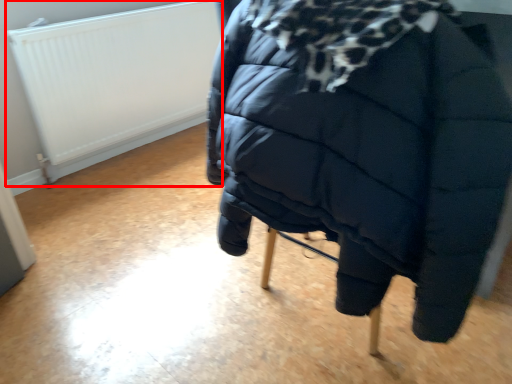
Question: In this image, where is radiator (annotated by the red box) located relative to furniture?

Choices:
 (A) right
 (B) left

Answer: (B)